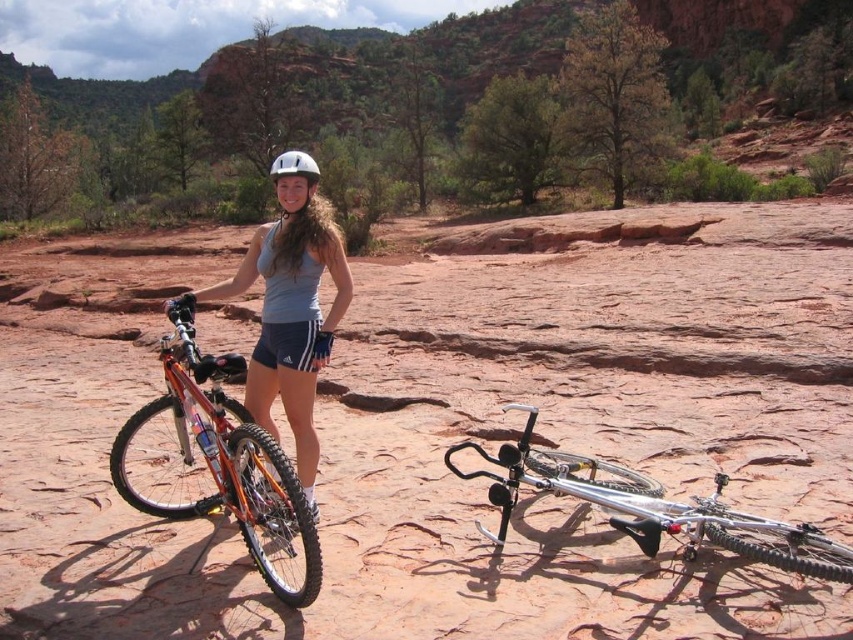
Is orange matte mountain bike at left shorter than matte gray tank top at center?

Yes.

Does orange matte mountain bike at left appear over matte gray tank top at center?

Incorrect, orange matte mountain bike at left is not positioned above matte gray tank top at center.

This screenshot has width=853, height=640. Find the location of `orange matte mountain bike at left`. orange matte mountain bike at left is located at coordinates (225, 460).

You are a GUI agent. You are given a task and a screenshot of the screen. Output one action in this format:
    pyautogui.click(x=<x>, y=<y>)
    Task: Click on the orange matte mountain bike at left
    
    Given the screenshot: What is the action you would take?
    pyautogui.click(x=225, y=460)

Measure the distance between orange matte mountain bike at left and camera.

A distance of 6.42 meters exists between orange matte mountain bike at left and camera.

Between point (161, 502) and point (697, 508), which one is positioned behind?

Positioned behind is point (161, 502).

What are the coordinates of `orange matte mountain bike at left` in the screenshot? It's located at (225, 460).

The width and height of the screenshot is (853, 640). What are the coordinates of `orange matte mountain bike at left` in the screenshot? It's located at (225, 460).

Is dirt field at center positioned at the back of silver metallic bicycle at lower right?

Yes, dirt field at center is behind silver metallic bicycle at lower right.

Does dirt field at center have a greater width compared to silver metallic bicycle at lower right?

Yes, dirt field at center is wider than silver metallic bicycle at lower right.

Between point (381, 516) and point (788, 566), which one is positioned behind?

Point (381, 516)

Locate an element on the screen. dirt field at center is located at coordinates (453, 428).